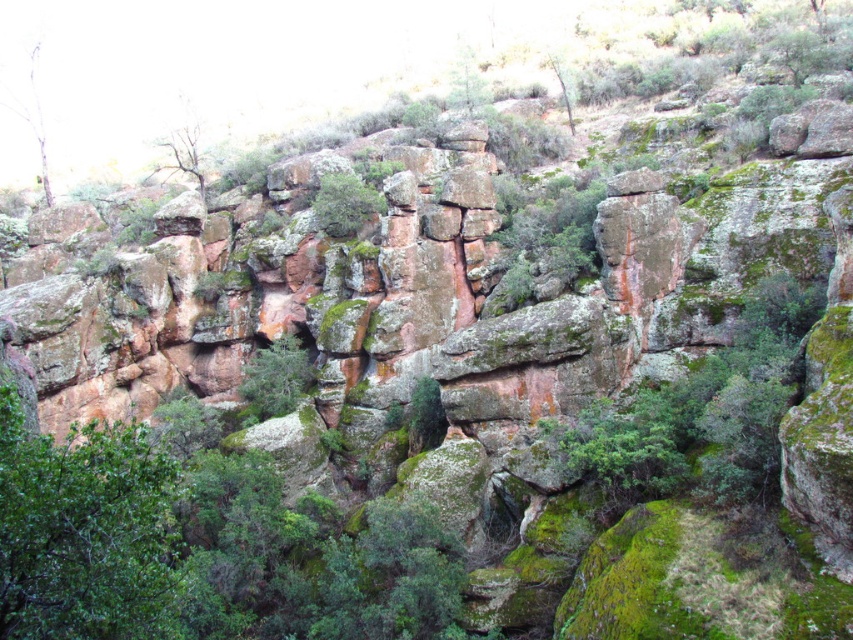
Can you confirm if green mossy rock at center is positioned to the left of green mossy rock at upper center?

Indeed, green mossy rock at center is positioned on the left side of green mossy rock at upper center.

Does green mossy rock at center appear under green mossy rock at upper center?

Correct, green mossy rock at center is located below green mossy rock at upper center.

Is point (352, 195) positioned behind point (473, 80)?

No, (352, 195) is in front of (473, 80).

Where is `green mossy rock at center`? green mossy rock at center is located at coordinates (345, 204).

Who is shorter, green mossy rock at upper center or green mossy tree at upper center?

green mossy tree at upper center

Consider the image. Is green mossy rock at upper center wider than green mossy tree at upper center?

Yes.

Is point (467, 74) less distant than point (553, 67)?

No.

You are a GUI agent. You are given a task and a screenshot of the screen. Output one action in this format:
    pyautogui.click(x=<x>, y=<y>)
    Task: Click on the green mossy rock at upper center
    
    Given the screenshot: What is the action you would take?
    pyautogui.click(x=466, y=81)

Between green mossy rock at center and green mossy tree at upper left, which one is positioned lower?

green mossy rock at center is below.

Is green mossy rock at center in front of green mossy tree at upper left?

Yes.

You are a GUI agent. You are given a task and a screenshot of the screen. Output one action in this format:
    pyautogui.click(x=<x>, y=<y>)
    Task: Click on the green mossy rock at center
    Image resolution: width=853 pixels, height=640 pixels.
    Given the screenshot: What is the action you would take?
    pyautogui.click(x=345, y=204)

Find the location of `green mossy rock at center`. green mossy rock at center is located at coordinates (345, 204).